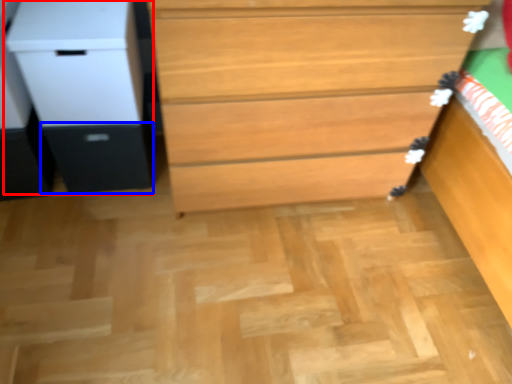
Question: Which object appears farthest to the camera in this image, file cabinet (highlighted by a red box) or drawer (highlighted by a blue box)?

Choices:
 (A) file cabinet
 (B) drawer

Answer: (B)